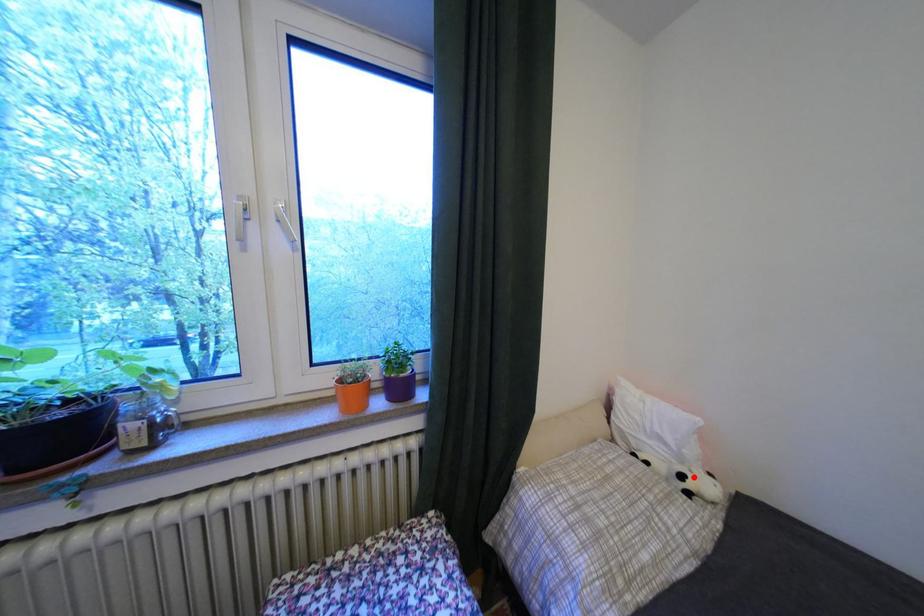
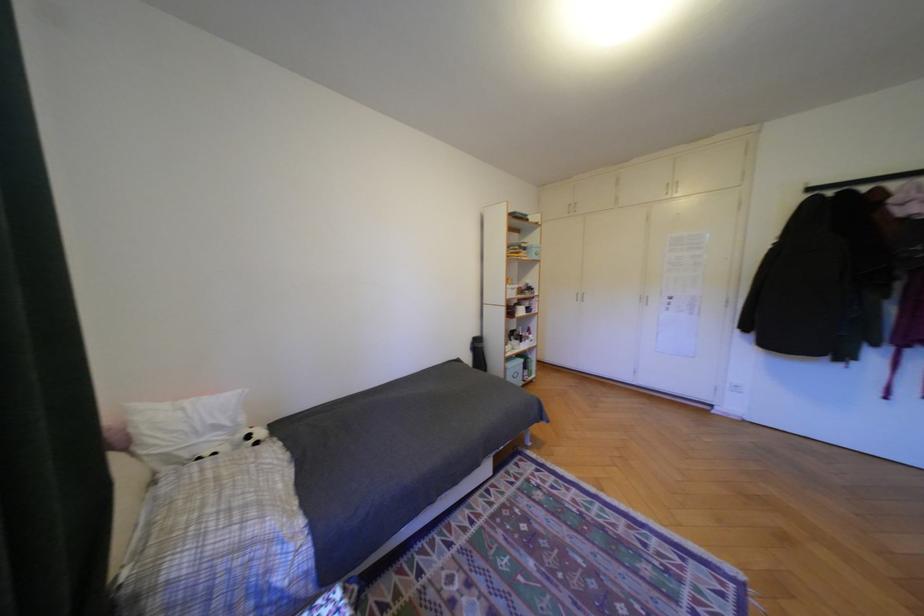
Question: I am providing you with two images of the same scene from different viewpoints. In image1, a red point is highlighted. Considering the same 3D point in image2, which of the following is correct?

Choices:
 (A) It is closer
 (B) It is farther

Answer: (A)